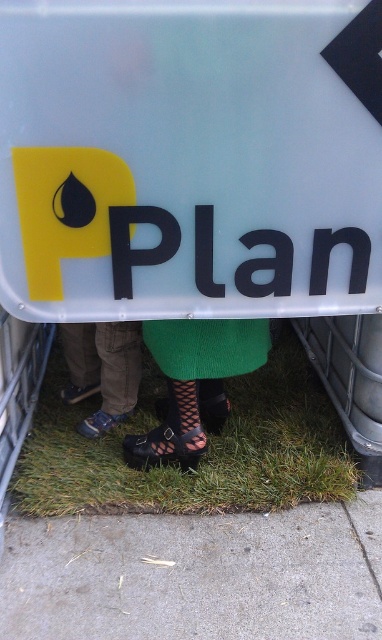
You are standing at the point marked as point (231, 81). You want to walk to the signboard. Which direction should you go?

Since the signboard is mounted on a metallic frame partially visible at the edges of the image, and the two individuals are standing in front of the signboard on a patch of grass, you should walk towards the signboard from the point (231, 81) by moving forward in the direction where the grass is located, away from the metallic frame edges.

You are standing in front of the signboard and want to place a small sticker exactly at the point marked by the coordinates point [189,157]. Based on the scene description, where should you place the sticker on the signboard?

The point [189,157] indicates the matte plastic sign at upper center, so you should place the sticker at the upper center of the matte plastic sign.